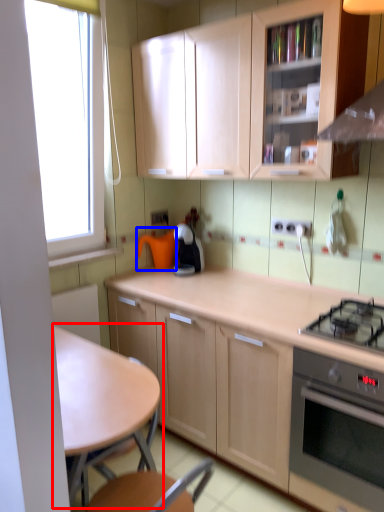
Question: Which point is closer to the camera, table (highlighted by a red box) or appliance (highlighted by a blue box)?

Choices:
 (A) table
 (B) appliance

Answer: (A)